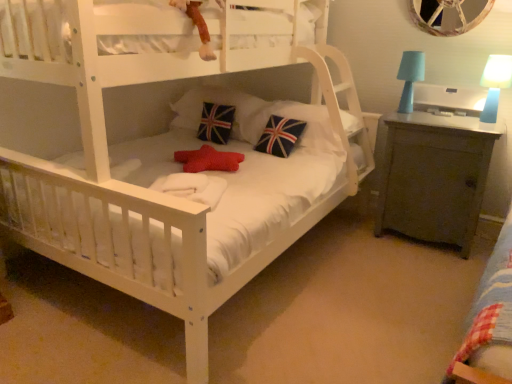
Identify the location of vacant area in front of matte gray cabinet at right. (426, 275).